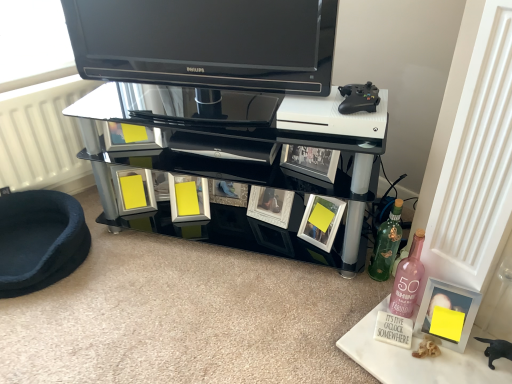
Locate an element on the screen. free space in front of dark blue plush pet bed at lower left is located at coordinates (53, 330).